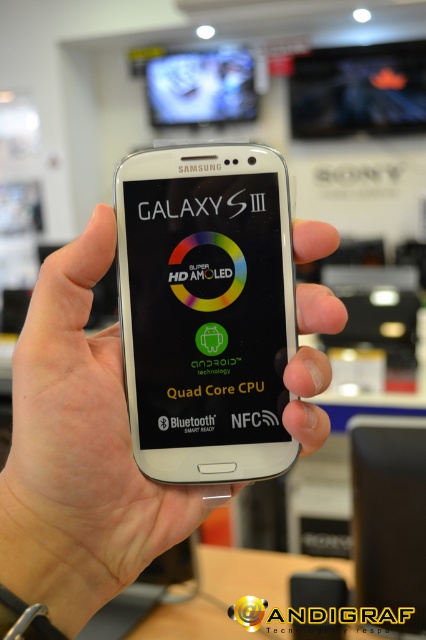
Is white glossy phone at center wider than white matte phone at center?

In fact, white glossy phone at center might be narrower than white matte phone at center.

Consider the image. Who is positioned more to the right, white glossy phone at center or white matte phone at center?

white glossy phone at center

Is point (189, 426) positioned in front of point (299, 253)?

That is False.

What are the coordinates of `white glossy phone at center` in the screenshot? It's located at (206, 310).

Consider the image. Does white matte phone at center have a greater width compared to matte black screen at upper center?

No, white matte phone at center is not wider than matte black screen at upper center.

Does white matte phone at center have a smaller size compared to matte black screen at upper center?

Indeed, white matte phone at center has a smaller size compared to matte black screen at upper center.

Does point (40, 420) come farther from viewer compared to point (221, 93)?

That is False.

Find the location of `white matte phone at center`. white matte phone at center is located at coordinates (80, 444).

Can you confirm if white glossy phone at center is positioned to the right of matte black screen at upper center?

Indeed, white glossy phone at center is positioned on the right side of matte black screen at upper center.

Can you confirm if white glossy phone at center is taller than matte black screen at upper center?

No, white glossy phone at center is not taller than matte black screen at upper center.

Which is behind, point (123, 314) or point (235, 64)?

The point (235, 64) is behind.

You are a GUI agent. You are given a task and a screenshot of the screen. Output one action in this format:
    pyautogui.click(x=<x>, y=<y>)
    Task: Click on the white glossy phone at center
    This screenshot has height=640, width=426.
    Given the screenshot: What is the action you would take?
    pyautogui.click(x=206, y=310)